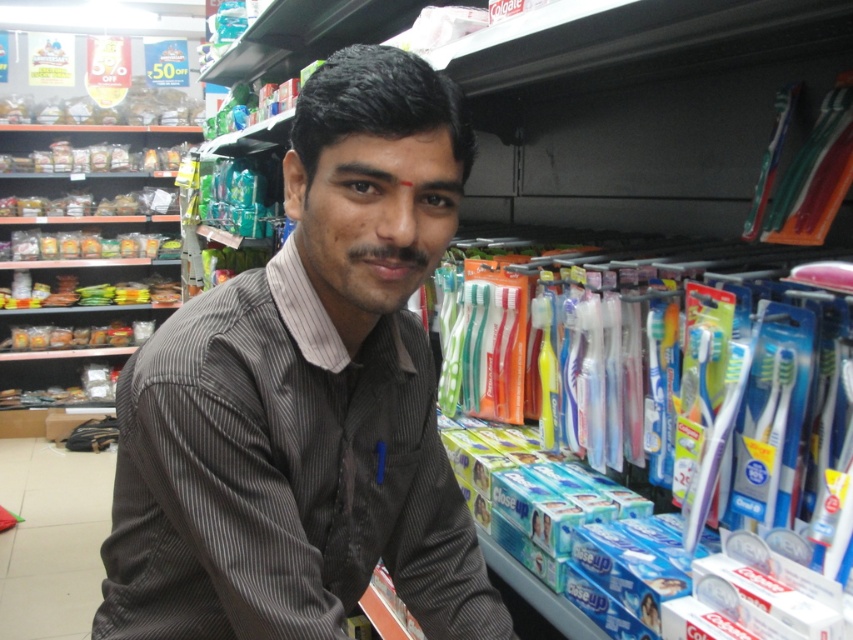
Looking at this image, you are a customer in the store and want to place a new toothbrush display between the translucent plastic toothbrush at right and the translucent plastic toothbrush at upper right. The display requires 14 inches of space. Do you think there is enough space between them?

The distance between the translucent plastic toothbrush at right and the translucent plastic toothbrush at upper right is 12.28 inches, which is less than the required 14 inches. Therefore, there is not enough space to place the display between them.

You are a customer in the store and want to grab the translucent plastic toothbrush at right. However, the shopkeeper wearing the dark gray striped shirt at center is blocking your view. Can you reach the toothbrush without moving the shopkeeper?

The dark gray striped shirt at center is in front of the translucent plastic toothbrush at right, so the shopkeeper is blocking your direct access to the toothbrush. You would need to either move around the shopkeeper or ask them to step aside to reach it.